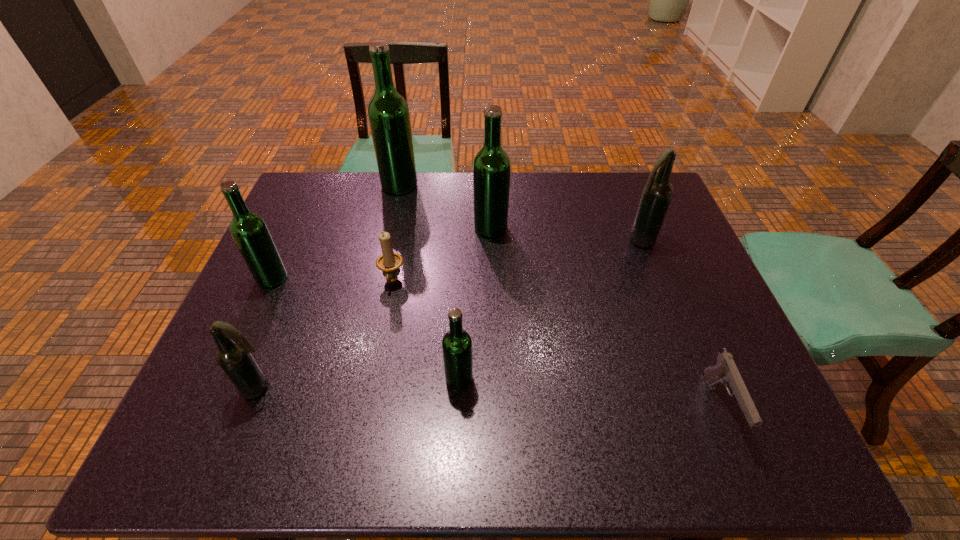
Where is `the nearest green beer bottle`? This screenshot has height=540, width=960. the nearest green beer bottle is located at coordinates (456, 344).

I want to click on the seventh tallest object, so click(389, 262).

Locate an element on the screen. The image size is (960, 540). pistol is located at coordinates (725, 371).

Find the location of `blank space located 0.080m on the right of the biggest green beer bottle`. blank space located 0.080m on the right of the biggest green beer bottle is located at coordinates (442, 186).

Locate an element on the screen. The image size is (960, 540). vacant area situated 0.080m on the front of the second farthest green beer bottle is located at coordinates (492, 258).

I want to click on free spot located 0.380m on the left of the farther dark beer bottle, so [x=492, y=240].

You are a GUI agent. You are given a task and a screenshot of the screen. Output one action in this format:
    pyautogui.click(x=<x>, y=<y>)
    Task: Click on the vacant position located 0.180m on the back of the third biggest green beer bottle
    The width and height of the screenshot is (960, 540).
    Given the screenshot: What is the action you would take?
    (296, 226)

This screenshot has height=540, width=960. What are the coordinates of `vacant space situated 0.180m on the back of the smaller dark beer bottle` in the screenshot? It's located at (289, 314).

Locate an element on the screen. vacant position located 0.250m on the left of the nearest green beer bottle is located at coordinates (331, 379).

Image resolution: width=960 pixels, height=540 pixels. I want to click on vacant space located 0.400m on the handle side of the seventh tallest object, so click(361, 444).